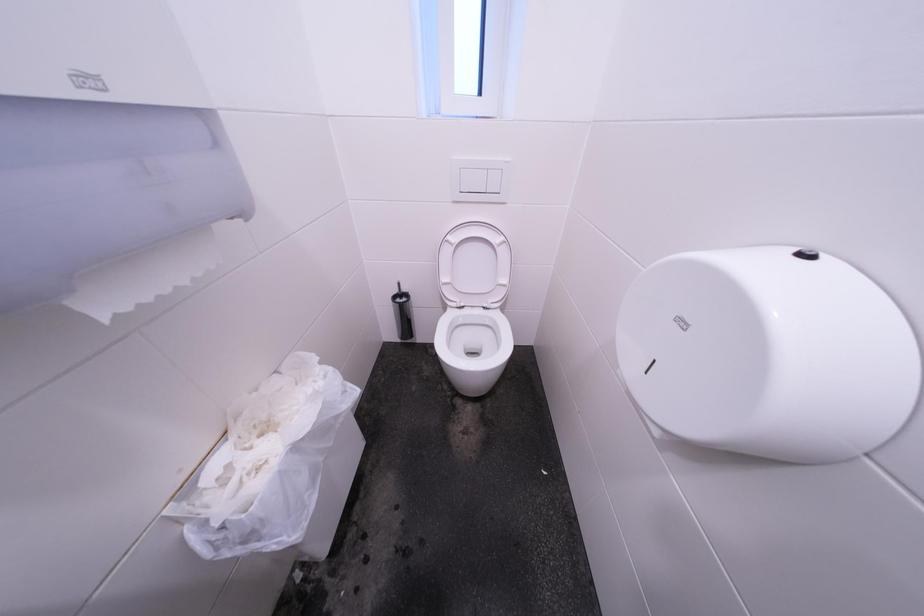
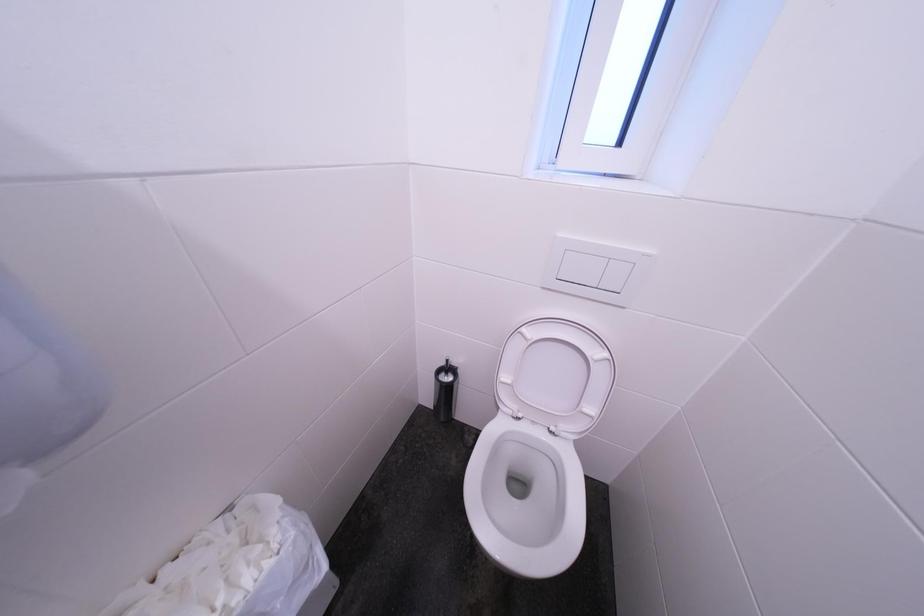
Question: The camera is either moving clockwise (left) or counter-clockwise (right) around the object. The first image is from the beginning of the video and the second image is from the end. Is the camera moving left or right when shooting the video?

Choices:
 (A) Left
 (B) Right

Answer: (B)